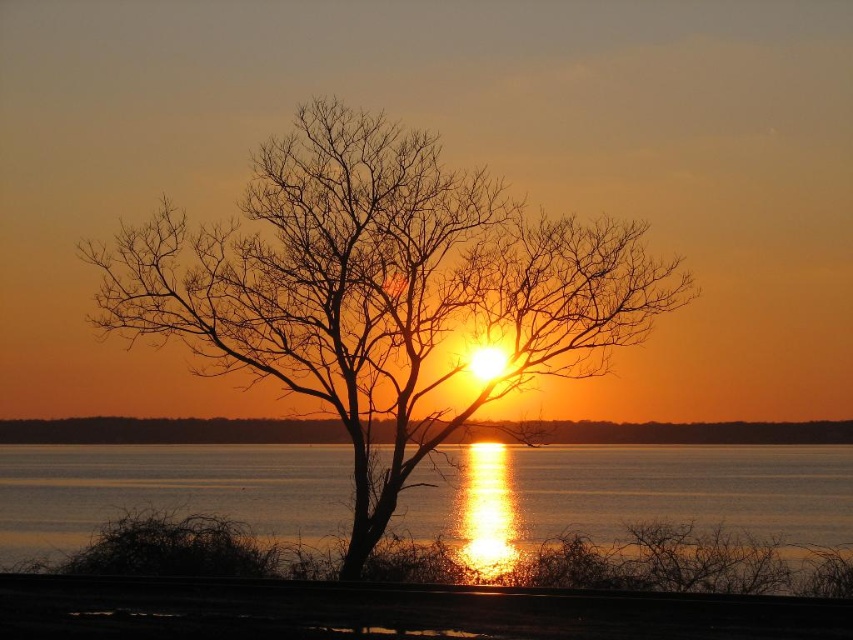
Consider the image. You are a painter who wants to capture the sunset scene. You have a canvas that is 3 feet wide. If you want to paint both the smooth water at center and the smooth orange sky at center on the same canvas, will they fit side by side?

The smooth water at center and smooth orange sky at center are 10.68 feet apart from each other. Since the canvas is only 3 feet wide, they cannot fit side by side on the canvas.